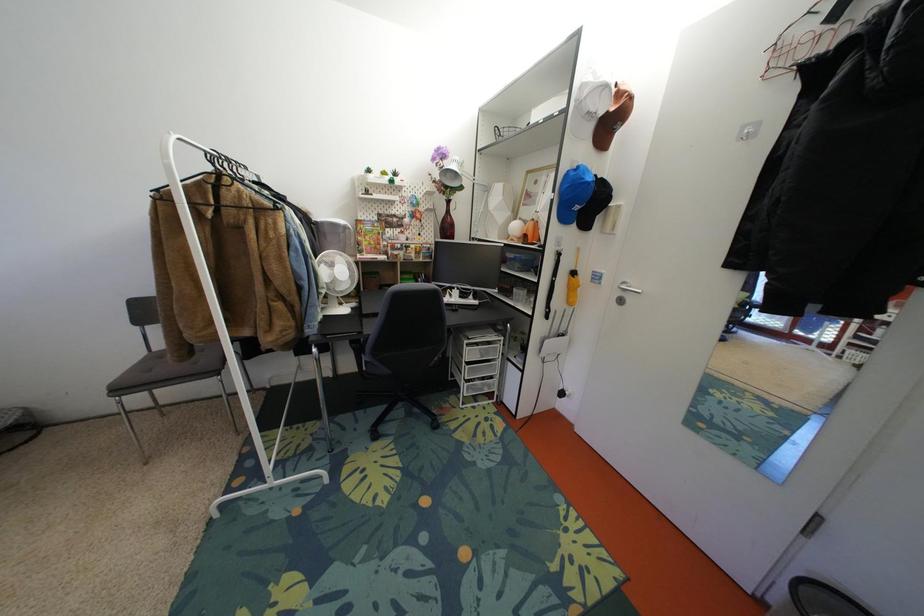
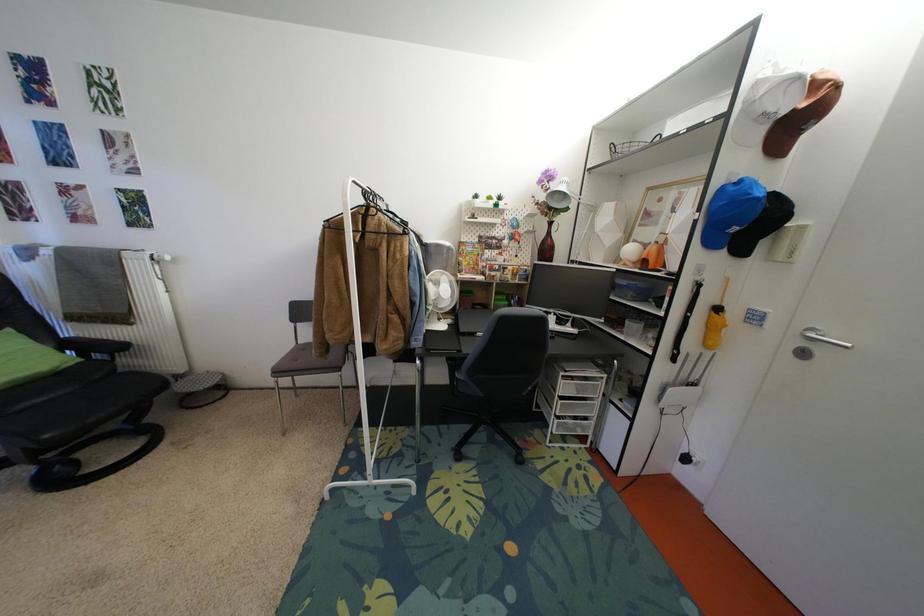
Question: The images are taken continuously from a first-person perspective. In which direction is your viewpoint rotating?

Choices:
 (A) Left
 (B) Right
 (C) Up
 (D) Down

Answer: (A)